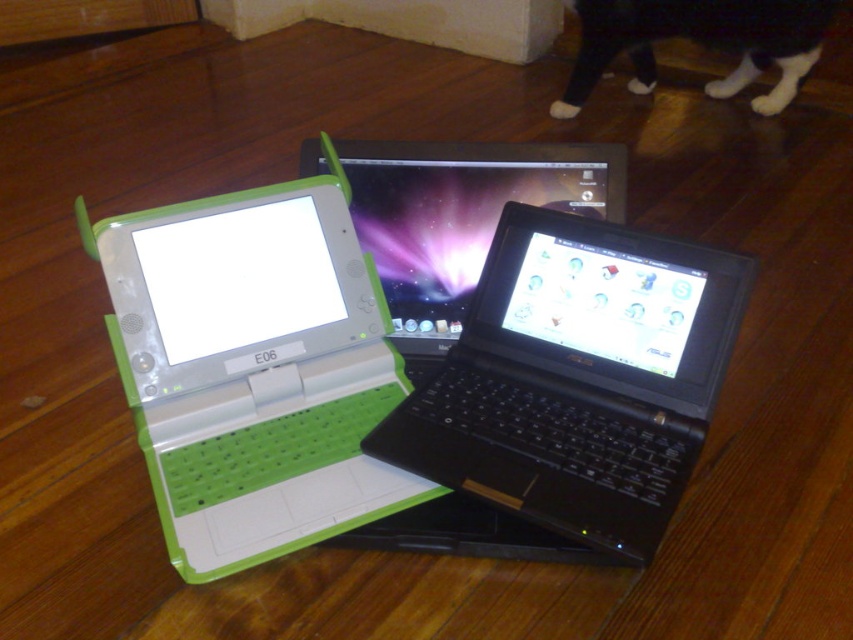
Based on the photo, you are trying to decide which laptop to use for a long video editing session. Considering the size and screen space, which laptop between the green matte laptop at center and the black plastic laptop at center would be more suitable?

The green matte laptop at center is bigger than the black plastic laptop at center, so it would provide more screen space and comfort for a long video editing session.

You are trying to pick up the green matte laptop at center to move it. Can you lift it without moving the black plastic laptop at center first?

The green matte laptop at center is positioned over the black plastic laptop at center, so you can lift the green matte laptop at center without needing to move the black plastic laptop at center first.